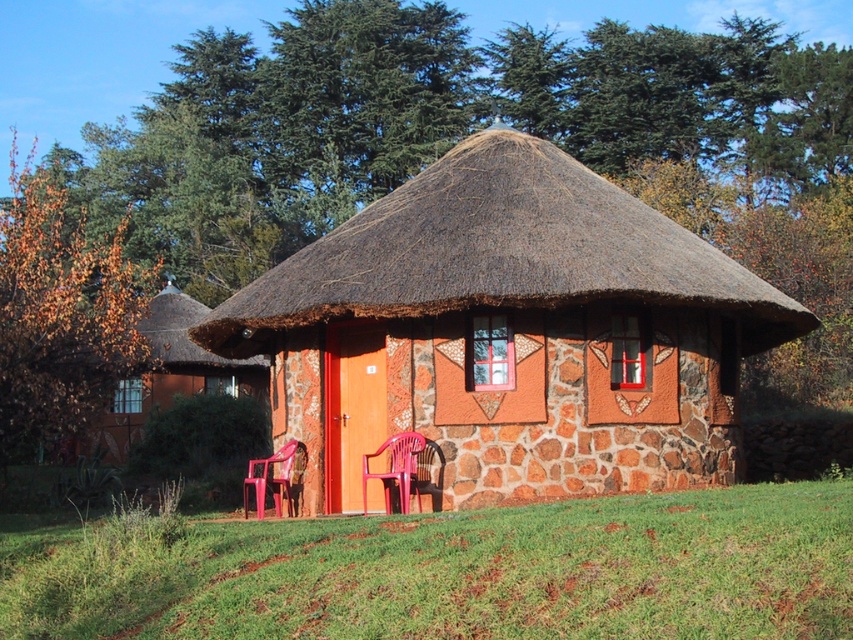
Who is lower down, brown stone hut at center or translucent plastic chair at lower center?

Positioned lower is translucent plastic chair at lower center.

Does brown stone hut at center appear on the right side of translucent plastic chair at lower center?

In fact, brown stone hut at center is to the left of translucent plastic chair at lower center.

Does point (175, 346) lie behind point (287, 451)?

Yes.

You are a GUI agent. You are given a task and a screenshot of the screen. Output one action in this format:
    pyautogui.click(x=<x>, y=<y>)
    Task: Click on the brown stone hut at center
    
    Given the screenshot: What is the action you would take?
    pyautogui.click(x=164, y=378)

Who is higher up, green grass at lower center or brown stone hut at center?

brown stone hut at center

Between green grass at lower center and brown stone hut at center, which one has less height?

green grass at lower center

Measure the distance between point [706,522] and camera.

Point [706,522] and camera are 8.46 meters apart.

Image resolution: width=853 pixels, height=640 pixels. Find the location of `green grass at lower center`. green grass at lower center is located at coordinates (457, 572).

Who is positioned more to the left, brown stone hut at center or matte plastic chair at center?

Positioned to the left is brown stone hut at center.

Is brown stone hut at center behind matte plastic chair at center?

Yes.

In order to click on brown stone hut at center in this screenshot , I will do `click(164, 378)`.

The height and width of the screenshot is (640, 853). Find the location of `brown stone hut at center`. brown stone hut at center is located at coordinates (164, 378).